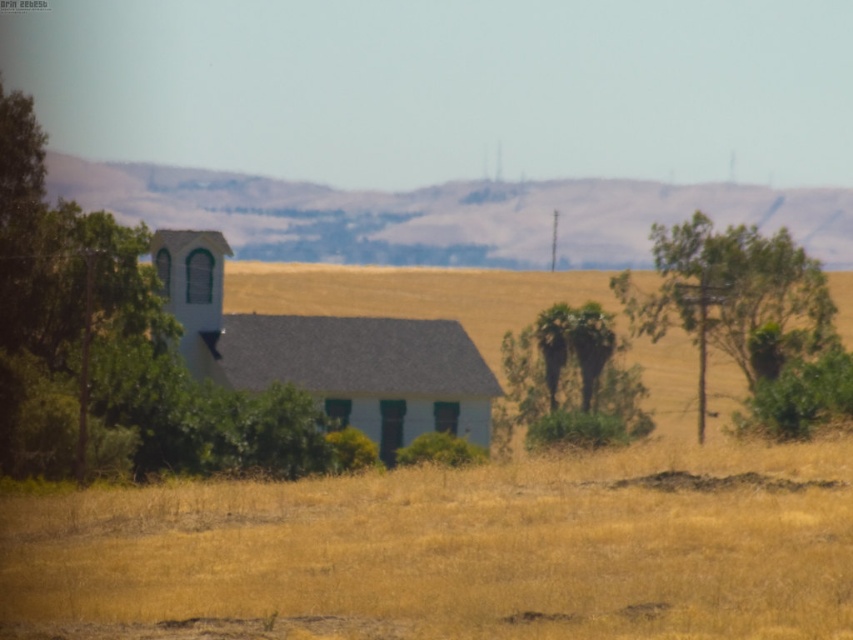
Describe the element at coordinates (328, 353) in the screenshot. I see `white matte church at center` at that location.

Does white matte church at center appear over green leafy tree at right?

No.

Which is behind, point (192, 330) or point (755, 323)?

The point (755, 323) is more distant.

At what (x,y) coordinates should I click in order to perform the action: click on white matte church at center. Please return your answer as a coordinate pair (x, y). Image resolution: width=853 pixels, height=640 pixels. Looking at the image, I should click on (328, 353).

Can you confirm if dry grass at center is shorter than green leafy tree at right?

Yes, dry grass at center is shorter than green leafy tree at right.

Does dry grass at center have a greater width compared to green leafy tree at right?

Indeed, dry grass at center has a greater width compared to green leafy tree at right.

Between point (294, 595) and point (703, 384), which one is positioned in front?

Positioned in front is point (294, 595).

Locate an element on the screen. The image size is (853, 640). dry grass at center is located at coordinates (453, 550).

Between green leafy tree at left and green leafy tree at right, which one appears on the left side from the viewer's perspective?

Positioned to the left is green leafy tree at left.

Is green leafy tree at left wider than green leafy tree at right?

No, green leafy tree at left is not wider than green leafy tree at right.

Does point (65, 353) lie behind point (747, 234)?

No, it is in front of (747, 234).

I want to click on green leafy tree at left, so click(57, 300).